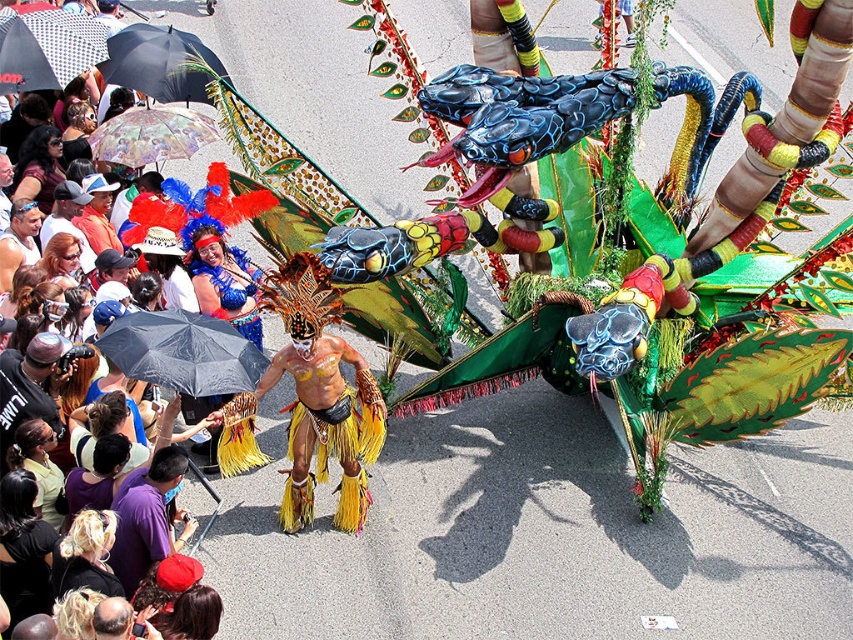
Does black dotted umbrella at upper left appear under purple fabric shirt at lower left?

Incorrect, black dotted umbrella at upper left is not positioned below purple fabric shirt at lower left.

I want to click on black dotted umbrella at upper left, so click(x=47, y=49).

Does point (91, 40) come in front of point (126, 522)?

No, (91, 40) is further to viewer.

Locate an element on the screen. The height and width of the screenshot is (640, 853). black dotted umbrella at upper left is located at coordinates (47, 49).

In the scene shown: Which is more to the right, black matte umbrella at left or purple fabric shirt at lower left?

Positioned to the right is black matte umbrella at left.

At what (x,y) coordinates should I click in order to perform the action: click on black matte umbrella at left. Please return your answer as a coordinate pair (x, y). Looking at the image, I should click on click(183, 353).

Does yellow fringed skirt at center have a smaller size compared to purple fabric shirt at lower left?

No, yellow fringed skirt at center is not smaller than purple fabric shirt at lower left.

The image size is (853, 640). What do you see at coordinates (311, 401) in the screenshot?
I see `yellow fringed skirt at center` at bounding box center [311, 401].

This screenshot has height=640, width=853. In order to click on yellow fringed skirt at center in this screenshot , I will do `click(311, 401)`.